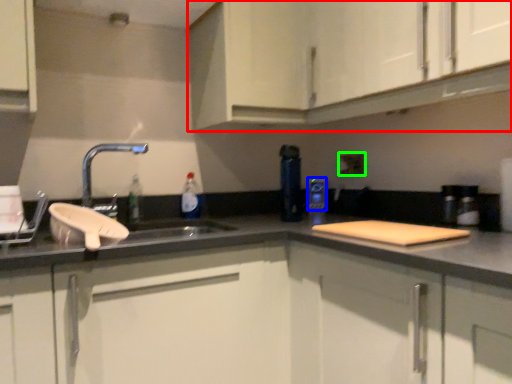
Question: Estimate the real-world distances between objects in this image. Which object is closer to cabinetry (highlighted by a red box), appliance (highlighted by a blue box) or electric outlet (highlighted by a green box)?

Choices:
 (A) appliance
 (B) electric outlet

Answer: (B)